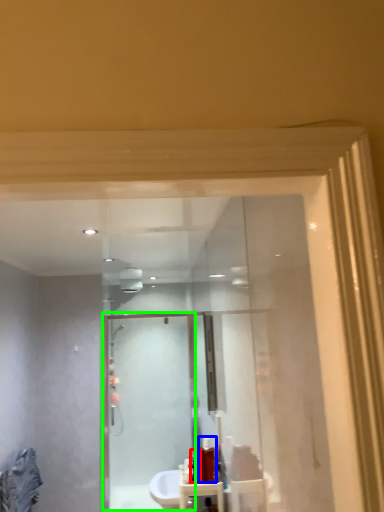
Question: Which object is positioned closest to toiletry (highlighted by a red box)? Select from toiletry (highlighted by a blue box) and screen door (highlighted by a green box).

Choices:
 (A) toiletry
 (B) screen door

Answer: (A)